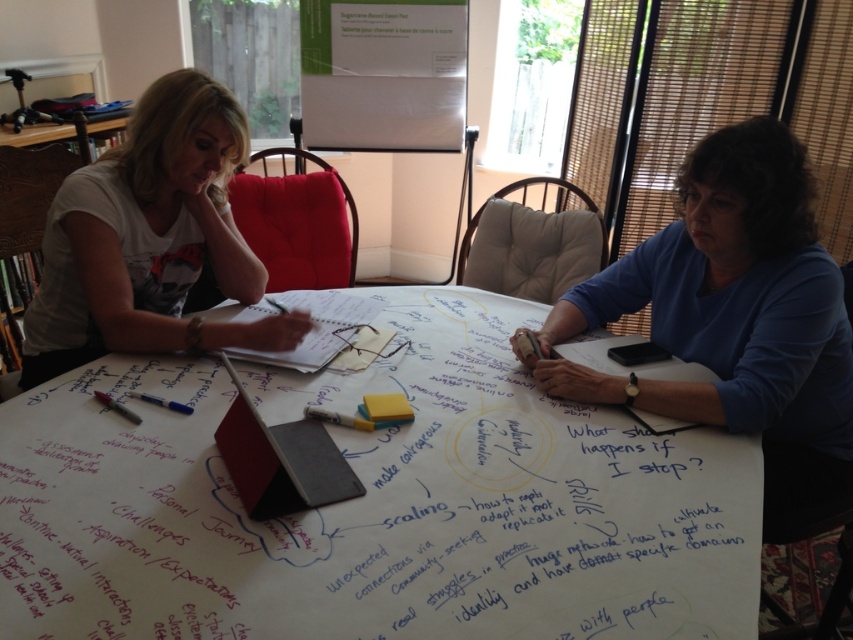
Consider the image. Can you confirm if white matte pen at center is positioned to the right of blue matte pen at center?

Yes, white matte pen at center is to the right of blue matte pen at center.

Consider the image. Can you confirm if white matte pen at center is thinner than blue matte pen at center?

Yes.

You are a GUI agent. You are given a task and a screenshot of the screen. Output one action in this format:
    pyautogui.click(x=<x>, y=<y>)
    Task: Click on the white matte pen at center
    The width and height of the screenshot is (853, 640).
    Given the screenshot: What is the action you would take?
    pyautogui.click(x=338, y=417)

Does matte white t-shirt at upper left have a lesser height compared to matte black pen at lower left?

Incorrect, matte white t-shirt at upper left's height does not fall short of matte black pen at lower left's.

In the scene shown: Is matte white t-shirt at upper left below matte black pen at lower left?

Actually, matte white t-shirt at upper left is above matte black pen at lower left.

Is point (165, 244) farther from camera compared to point (135, 420)?

Yes, point (165, 244) is farther from viewer.

You are a GUI agent. You are given a task and a screenshot of the screen. Output one action in this format:
    pyautogui.click(x=<x>, y=<y>)
    Task: Click on the matte white t-shirt at upper left
    This screenshot has width=853, height=640.
    Given the screenshot: What is the action you would take?
    pyautogui.click(x=149, y=240)

Who is higher up, white paperboard at center or blue matte pen at center?

blue matte pen at center

Between point (187, 636) and point (169, 401), which one is positioned behind?

The point (169, 401) is more distant.

Is point (640, 544) positioned before point (142, 397)?

Yes.

Where is `white paperboard at center`? The image size is (853, 640). white paperboard at center is located at coordinates (375, 506).